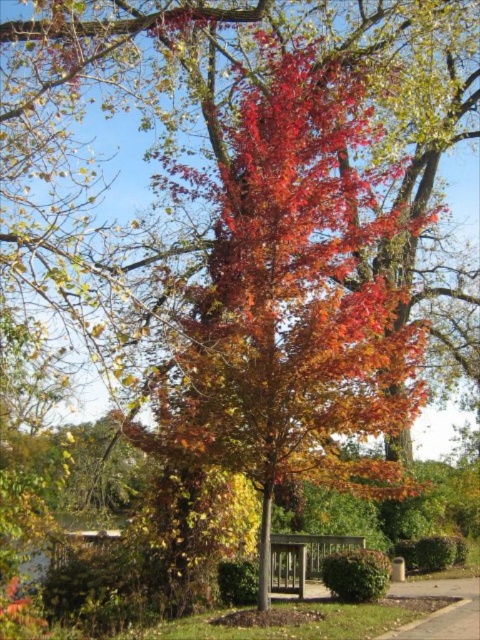
Can you confirm if shiny red leaves at center is positioned to the left of wooden park bench at center?

Incorrect, shiny red leaves at center is not on the left side of wooden park bench at center.

Is shiny red leaves at center shorter than wooden park bench at center?

In fact, shiny red leaves at center may be taller than wooden park bench at center.

Measure the distance between point [348,481] and camera.

Point [348,481] and camera are 12.23 meters apart from each other.

This screenshot has height=640, width=480. I want to click on shiny red leaves at center, so click(x=295, y=304).